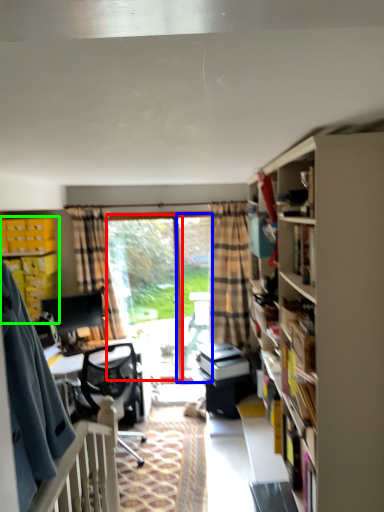
Question: Based on their relative distances, which object is nearer to window screen (highlighted by a red box)? Choose from screen door (highlighted by a blue box) and cabinet (highlighted by a green box).

Choices:
 (A) screen door
 (B) cabinet

Answer: (A)